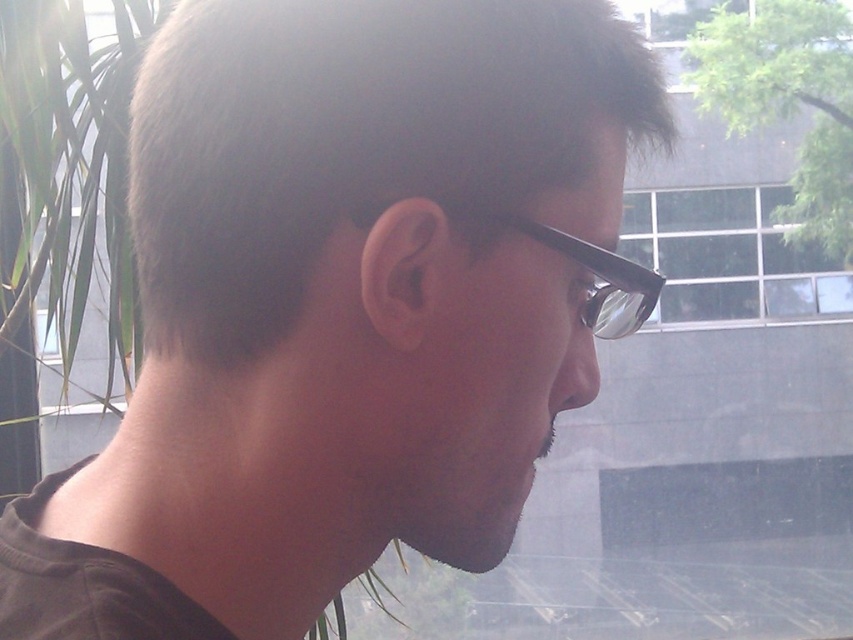
Question: Which object appears farthest from the camera in this image?

Choices:
 (A) black plastic glasses at center
 (B) green leafy plant at upper right

Answer: (B)

Question: Which point is closer to the camera?

Choices:
 (A) (368, 202)
 (B) (817, 147)

Answer: (A)

Question: Which point appears farthest from the camera in this image?

Choices:
 (A) (648, 282)
 (B) (827, 170)

Answer: (B)

Question: Is green leafy plant at upper right above black plastic glasses at center?

Choices:
 (A) no
 (B) yes

Answer: (B)

Question: Does green leafy plant at upper right appear over black plastic glasses at center?

Choices:
 (A) no
 (B) yes

Answer: (B)

Question: Is green leafy plant at upper right to the left of black plastic glasses at center from the viewer's perspective?

Choices:
 (A) no
 (B) yes

Answer: (A)